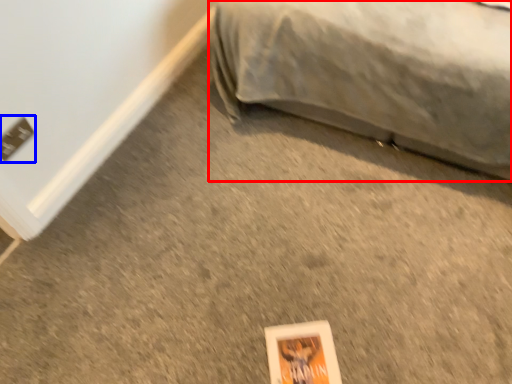
Question: Which object is closer to the camera taking this photo, furniture (highlighted by a red box) or electric outlet (highlighted by a blue box)?

Choices:
 (A) furniture
 (B) electric outlet

Answer: (A)